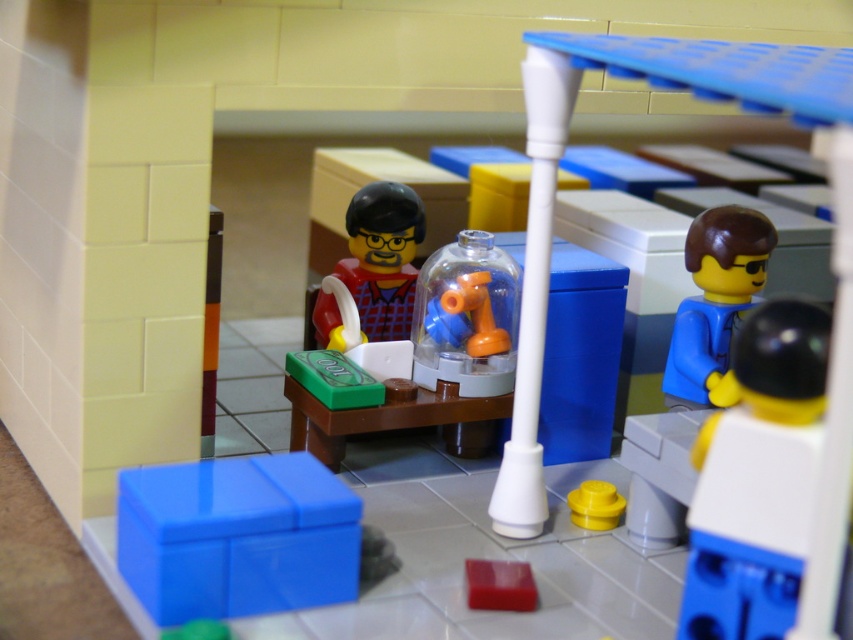
Based on the LEGO scene, is the white plastic figure at right positioned higher than the smooth red brick at lower center?

Yes, the white plastic figure at right is above the smooth red brick at lower center, meaning it is positioned higher.

You are a visitor looking at this LEGO scene. There is a point marked at coordinates (381, 257). What object is located at that point?

The point at coordinates (381, 257) marks the location of the matte red shirt at center.